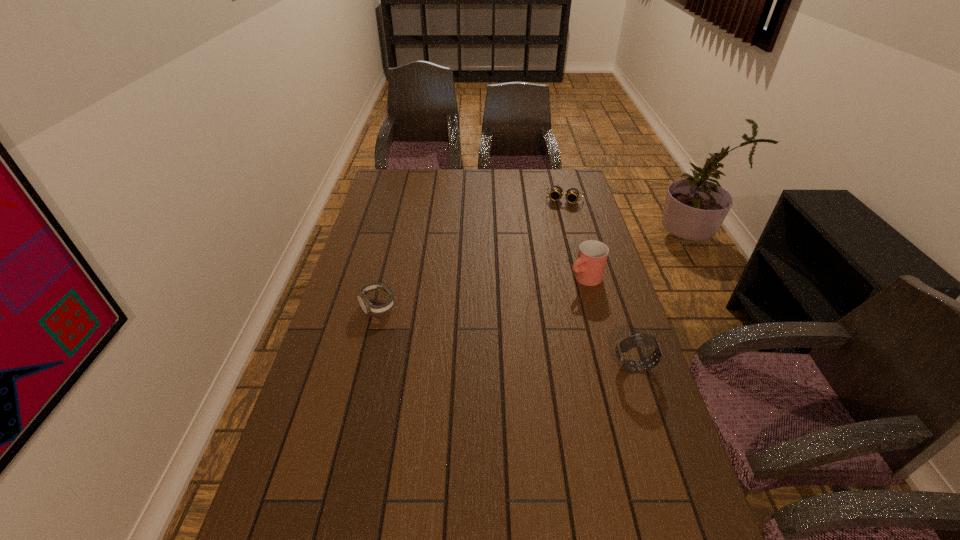
Locate an element on the screen. This screenshot has height=540, width=960. goggles present at the right edge is located at coordinates (556, 192).

Locate an element on the screen. This screenshot has height=540, width=960. cup present at the right edge is located at coordinates [589, 267].

Image resolution: width=960 pixels, height=540 pixels. Identify the location of object located in the far right corner section of the desktop. (556, 192).

Where is `vacant area at the far edge`? vacant area at the far edge is located at coordinates (450, 194).

Locate an element on the screen. The width and height of the screenshot is (960, 540). vacant point at the left edge is located at coordinates (340, 396).

The height and width of the screenshot is (540, 960). What are the coordinates of `vacant space at the right edge of the desktop` in the screenshot? It's located at pos(624,337).

Locate an element on the screen. This screenshot has width=960, height=540. vacant region at the far left corner of the desktop is located at coordinates (413, 189).

Where is `free space at the far right corner`? Image resolution: width=960 pixels, height=540 pixels. free space at the far right corner is located at coordinates (545, 174).

This screenshot has height=540, width=960. What are the coordinates of `free spot between the farthest object and the third farthest object` in the screenshot? It's located at (471, 253).

Where is `free space between the goggles and the third nearest object`? This screenshot has width=960, height=540. free space between the goggles and the third nearest object is located at coordinates (575, 239).